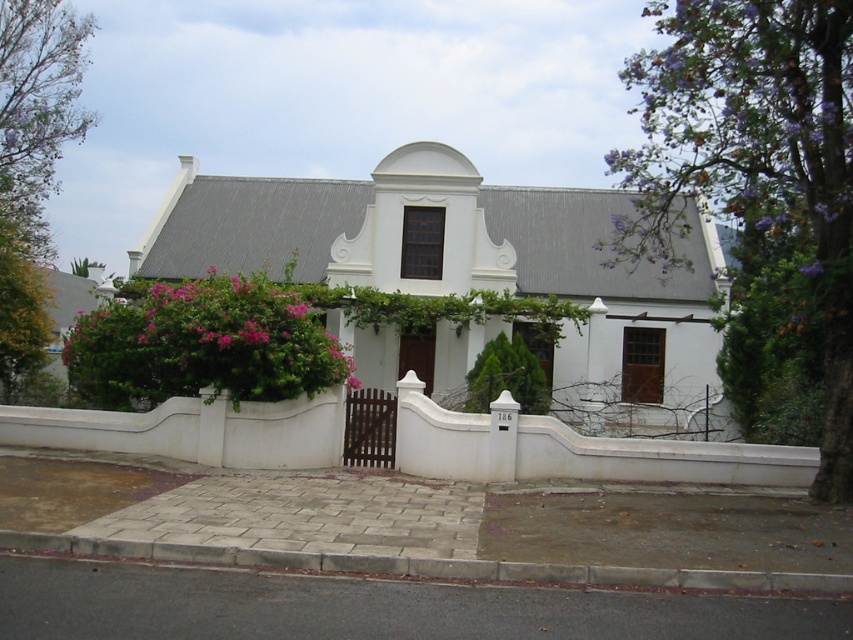
Question: Based on their relative distances, which object is nearer to the purple leafy tree at upper right?

Choices:
 (A) green leafy tree at left
 (B) pink matte flowers at center

Answer: (B)

Question: Is white smooth house at center to the left of pink matte flowers at center from the viewer's perspective?

Choices:
 (A) no
 (B) yes

Answer: (A)

Question: Does purple leafy tree at upper right have a lesser width compared to green leafy tree at left?

Choices:
 (A) yes
 (B) no

Answer: (A)

Question: Among these points, which one is farthest from the camera?

Choices:
 (A) (227, 346)
 (B) (25, 156)

Answer: (B)

Question: Which object is the closest to the green leafy tree at left?

Choices:
 (A) white smooth house at center
 (B) pink matte flowers at center
 (C) purple leafy tree at upper right

Answer: (A)

Question: Does purple leafy tree at upper right have a lesser width compared to green leafy tree at left?

Choices:
 (A) yes
 (B) no

Answer: (A)